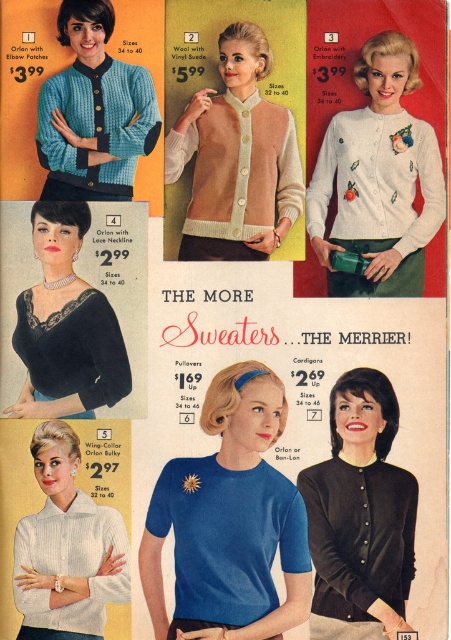
You are a customer looking to buy a sweater that can be worn over another top. Based on the advertisement, which sweater would you choose between the white embroidered cardigan at upper right and the velvet black blouse at lower left?

The white embroidered cardigan at upper right has a larger size compared to velvet black blouse at lower left, so it would be more suitable for wearing over another top.

Consider the image. You are a customer looking to buy a sweater that can accommodate a larger size. Based on the advertisement, which sweater between the teal knit sweater at upper left and the velvet black blouse at lower left should you choose?

The teal knit sweater at upper left has a larger size compared to the velvet black blouse at lower left, so you should choose the teal knit sweater at upper left.

You are a customer standing in front of the vintage advertisement. You want to know if you can comfortably fit both the white knit sweater at lower left and the velvet black blouse at lower left into a gift box that is 90 centimeters long. Can you determine if they will fit side by side?

The distance between the white knit sweater at lower left and the velvet black blouse at lower left is 87.75 centimeters. Since the gift box is 90 centimeters long, which is slightly longer than the combined width of both items, they should fit side by side with a small amount of space remaining.